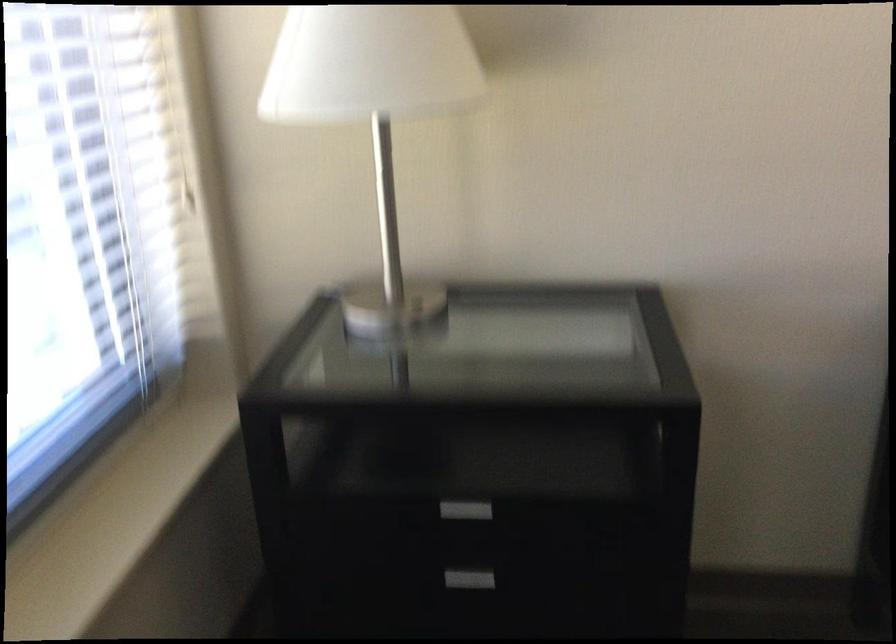
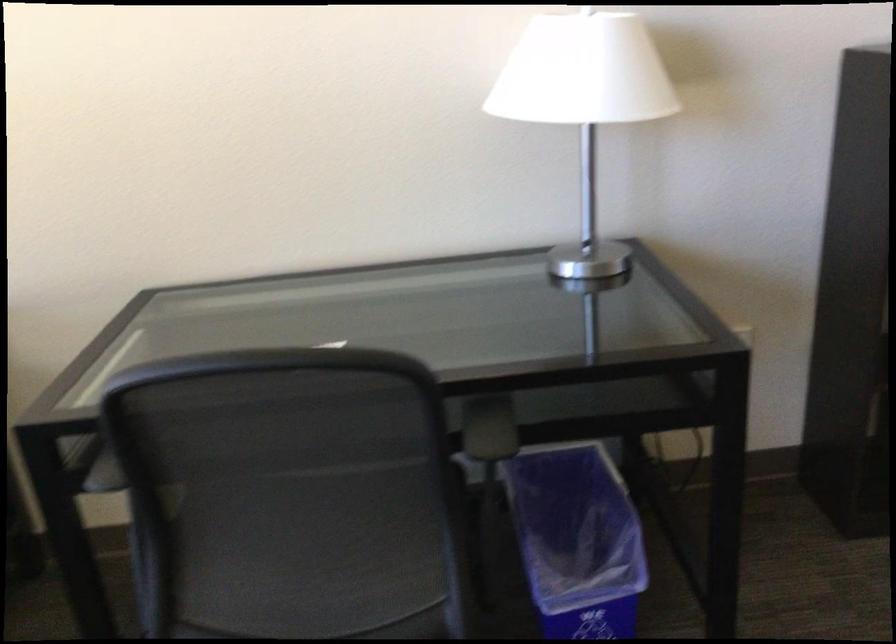
Which direction would the cameraman need to move to produce the second image?

The cameraman walked toward right, backward.